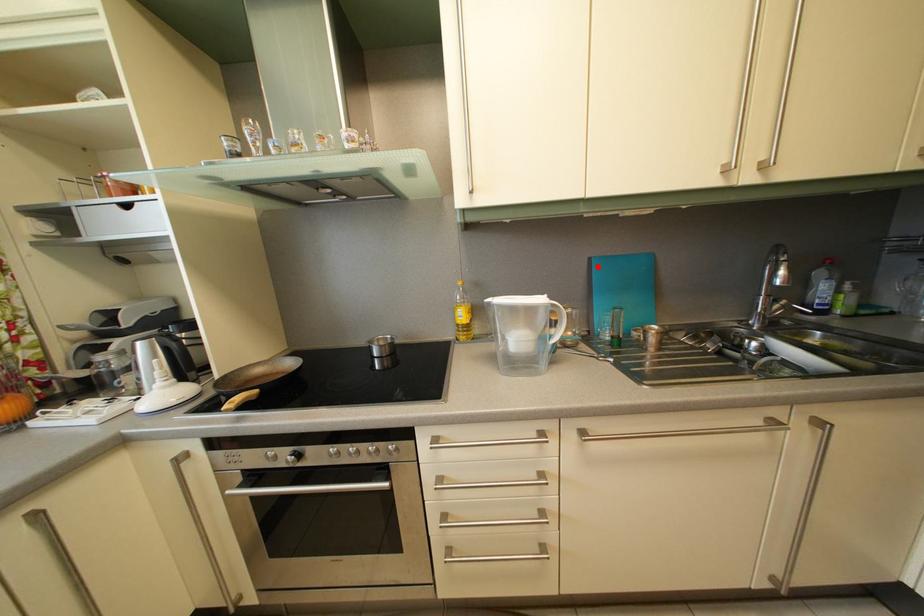
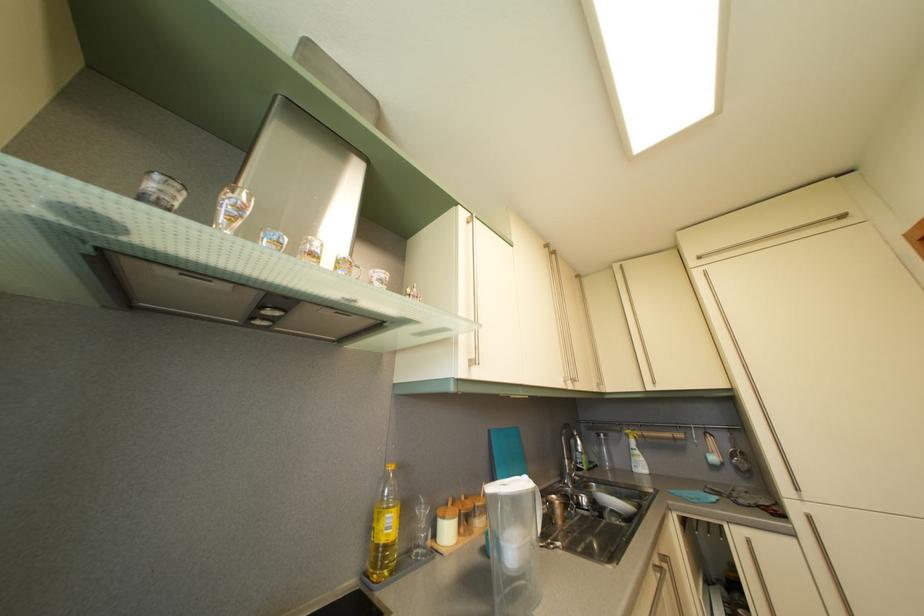
Locate, in the second image, the point that corresponds to the highlighted location in the first image.

(497, 439)